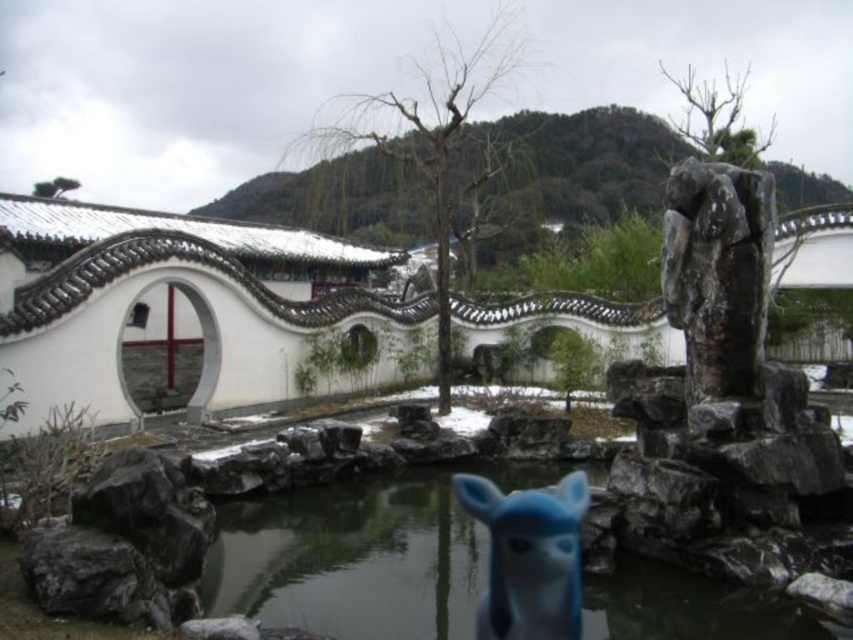
Between clear water at center and blue rubber animal at center, which one is positioned lower?

clear water at center is below.

Can you confirm if clear water at center is positioned to the right of blue rubber animal at center?

Incorrect, clear water at center is not on the right side of blue rubber animal at center.

What do you see at coordinates (360, 554) in the screenshot?
I see `clear water at center` at bounding box center [360, 554].

Where is `clear water at center`? clear water at center is located at coordinates (360, 554).

Is clear water at center in front of rough stone statue at right?

Yes, clear water at center is in front of rough stone statue at right.

Measure the distance between point [737,598] and camera.

Point [737,598] and camera are 64.57 feet apart from each other.

I want to click on clear water at center, so click(x=360, y=554).

Who is higher up, rough stone statue at right or blue rubber animal at center?

rough stone statue at right is above.

Between point (697, 260) and point (483, 628), which one is positioned in front?

Point (483, 628) is more forward.

Does point (753, 284) lie in front of point (561, 596)?

That is False.

Image resolution: width=853 pixels, height=640 pixels. What are the coordinates of `rough stone statue at right` in the screenshot? It's located at (718, 273).